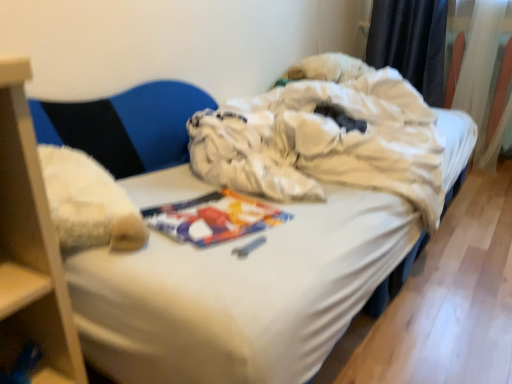
You are a GUI agent. You are given a task and a screenshot of the screen. Output one action in this format:
    pyautogui.click(x=<x>, y=<y>)
    Task: Click on the free point above fuzzy fabric armchair at left (from a real-world perspective)
    
    Given the screenshot: What is the action you would take?
    coord(127,66)